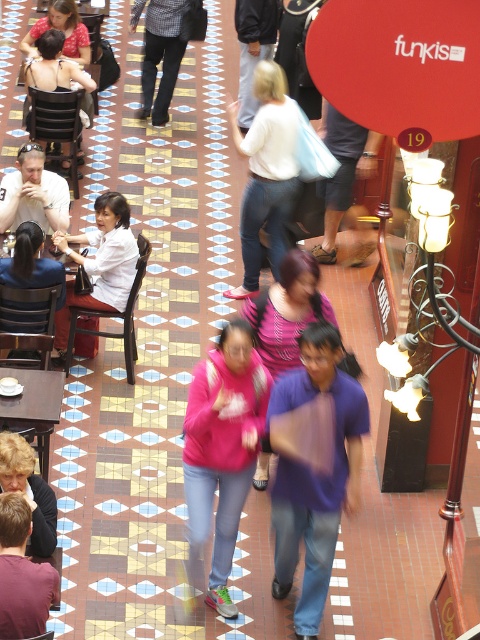
Question: Can you confirm if checkered fabric pants at upper center is positioned above matte white blouse at center?

Choices:
 (A) yes
 (B) no

Answer: (A)

Question: Can you confirm if purple cotton shirt at center is positioned to the right of wooden table at lower left?

Choices:
 (A) yes
 (B) no

Answer: (A)

Question: Which object appears closest to the camera in this image?

Choices:
 (A) wooden table at lower left
 (B) matte white shirt at upper left
 (C) matte white sweater at center

Answer: (A)

Question: Which object appears farthest from the camera in this image?

Choices:
 (A) pink matte hoodie at center
 (B) brown leather jacket at lower left
 (C) white matte shirt at center
 (D) matte white shirt at upper left

Answer: (D)

Question: Where is pink matte hoodie at center located in relation to matte black chair at upper left in the image?

Choices:
 (A) below
 (B) above

Answer: (A)

Question: Among these objects, which one is nearest to the camera?

Choices:
 (A) matte white shirt at upper left
 (B) pink matte hoodie at center
 (C) matte white blouse at center

Answer: (B)